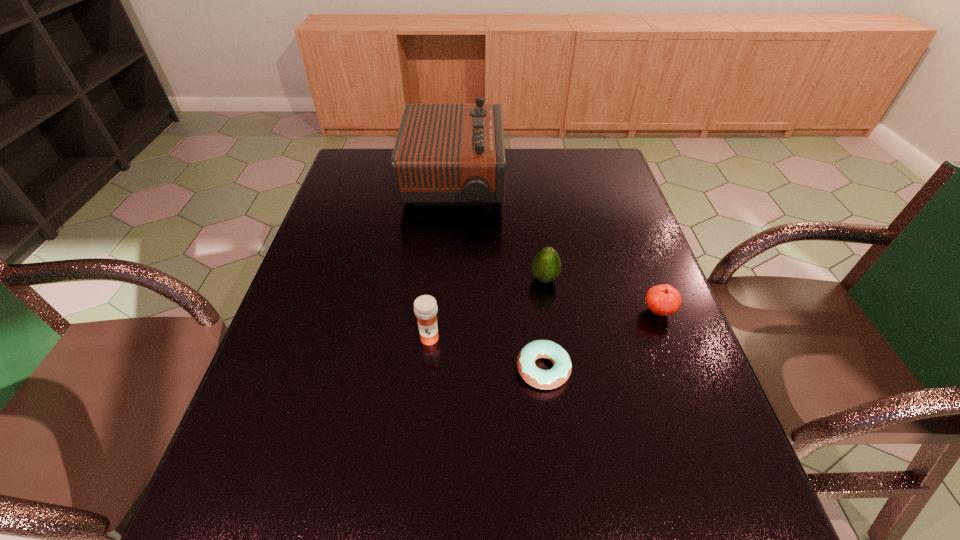
The image size is (960, 540). In order to click on free space between the avocado and the doughnut in this screenshot , I will do `click(544, 324)`.

Where is `vacant space in between the shortest object and the medicine`? The width and height of the screenshot is (960, 540). vacant space in between the shortest object and the medicine is located at coordinates (487, 354).

This screenshot has height=540, width=960. I want to click on vacant area that lies between the shortest object and the second farthest object, so click(544, 324).

Find the location of a particular element. Image resolution: width=960 pixels, height=540 pixels. free space between the rightmost object and the farthest object is located at coordinates (556, 247).

Where is `unoccupied area between the shortest object and the medicine`? Image resolution: width=960 pixels, height=540 pixels. unoccupied area between the shortest object and the medicine is located at coordinates (487, 354).

This screenshot has width=960, height=540. I want to click on vacant area that lies between the shortest object and the farthest object, so click(x=498, y=276).

This screenshot has width=960, height=540. I want to click on vacant space that's between the farthest object and the medicine, so click(442, 261).

You are a GUI agent. You are given a task and a screenshot of the screen. Output one action in this format:
    pyautogui.click(x=<x>, y=<y>)
    Task: Click on the free space between the farthest object and the shortest object
    The image size is (960, 540).
    Given the screenshot: What is the action you would take?
    pyautogui.click(x=498, y=276)

In order to click on free spot between the avocado and the medicine in this screenshot , I will do click(487, 309).

Locate which object is the second closest to the doughnut. Please provide its 2D coordinates. Your answer should be formatted as a tuple, i.e. [(x, y)], where the tuple contains the x and y coordinates of a point satisfying the conditions above.

[(546, 267)]